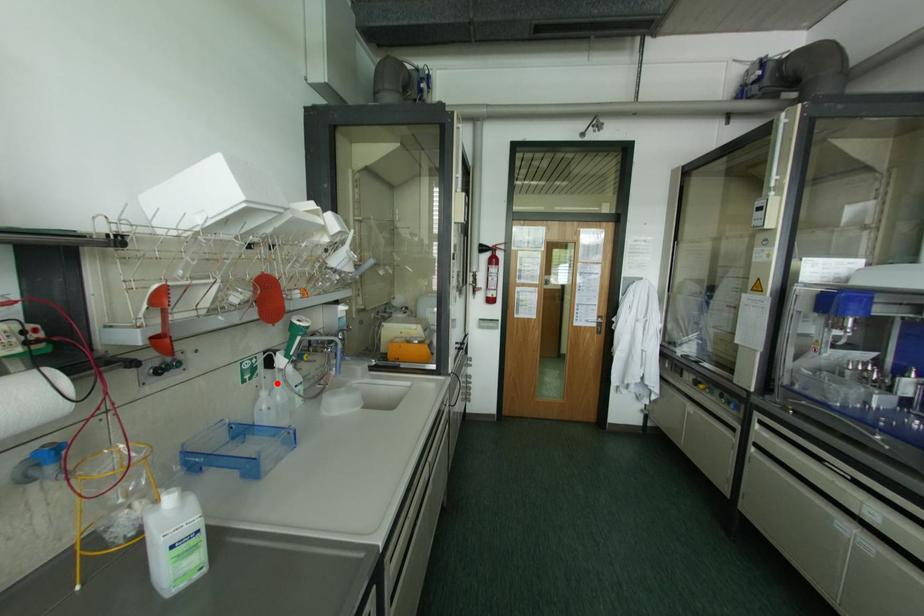
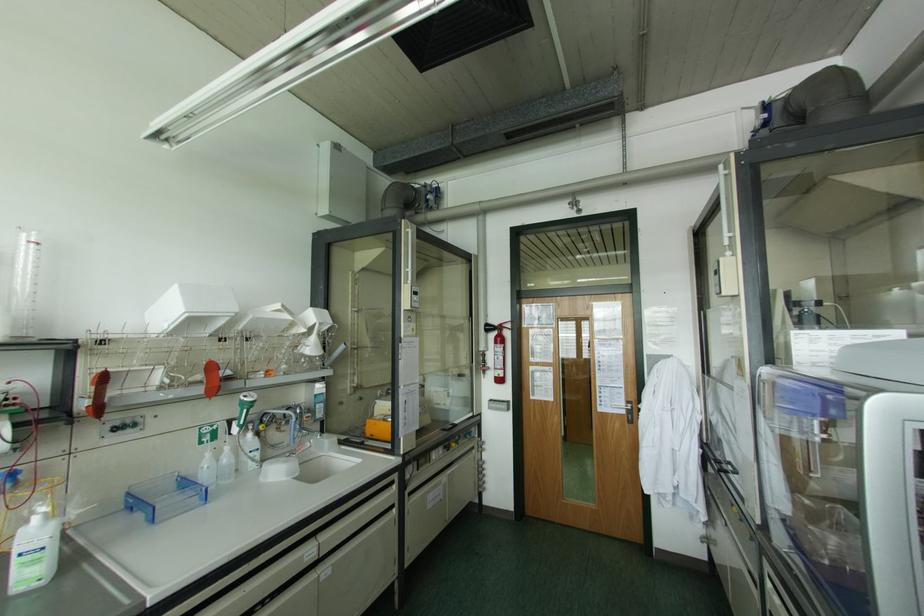
Where in the second image is the point corresponding to the highlighted location from the first image?

(226, 448)